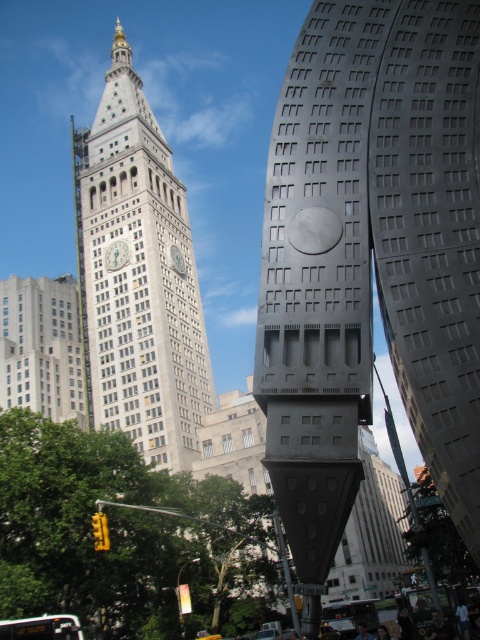
Question: Observing the image, what is the correct spatial positioning of silver metallic clock at upper center in reference to silver metallic clock at center?

Choices:
 (A) right
 (B) left

Answer: (B)

Question: Which object appears farthest from the camera in this image?

Choices:
 (A) silver metallic clock at center
 (B) white stone clock tower at center
 (C) silver metallic clock at upper center

Answer: (A)

Question: Can you confirm if silver metallic clock at upper center is smaller than silver metallic clock at center?

Choices:
 (A) no
 (B) yes

Answer: (B)

Question: Which point is farther to the camera?

Choices:
 (A) (113, 262)
 (B) (312, 328)
 (C) (181, 257)
 (D) (72, 140)

Answer: (D)

Question: Does gray metallic sculpture at center have a larger size compared to silver metallic clock at upper center?

Choices:
 (A) no
 (B) yes

Answer: (B)

Question: Which of the following is the closest to the observer?

Choices:
 (A) (108, 252)
 (B) (184, 262)
 (C) (207, 365)
 (D) (408, 333)

Answer: (D)